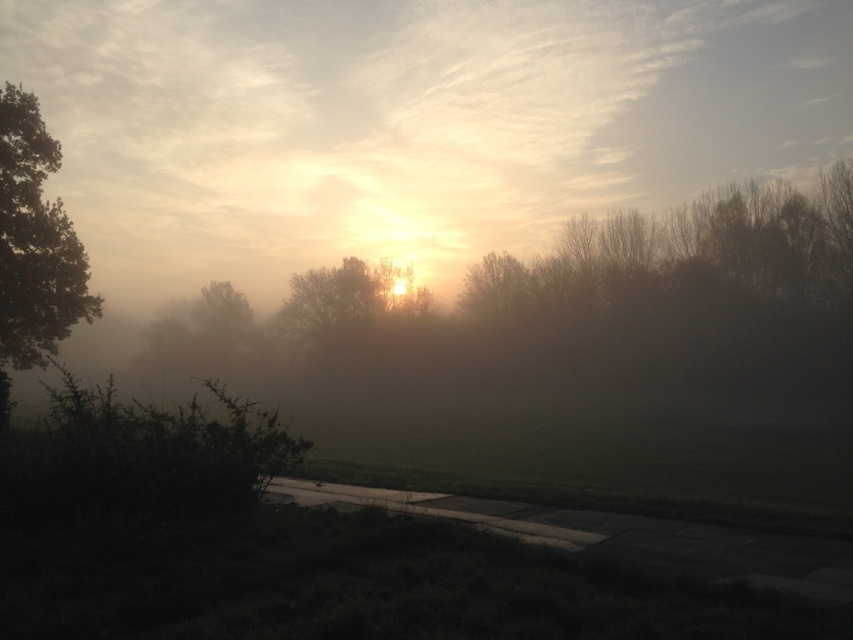
You are standing at the camera position and want to estimate how far the foggy sky at center is from you. What is the approximate distance?

The foggy sky at center is approximately 336.17 feet away from the camera.

You are a hiker planning to take a photo of the foggy sky at center and the green matte tree at left from a point 100 feet away from the tree. Can you fit both objects in your camera frame if your camera has a maximum field of view that can capture objects up to 200 feet apart?

The distance between the foggy sky at center and the green matte tree at left is 197.68 feet, which is within the camera field of view limit of 200 feet. Therefore, both objects can be captured in the same frame.

You are standing on the grassy area in the foreground and want to walk towards the sun. Which direction should you walk relative to the green matte tree at left and the foggy sky at center?

The foggy sky at center is to the right of the green matte tree at left. Since the sun is near the horizon in the foggy sky area, you should walk towards the right of the green matte tree at left to head towards the sun.